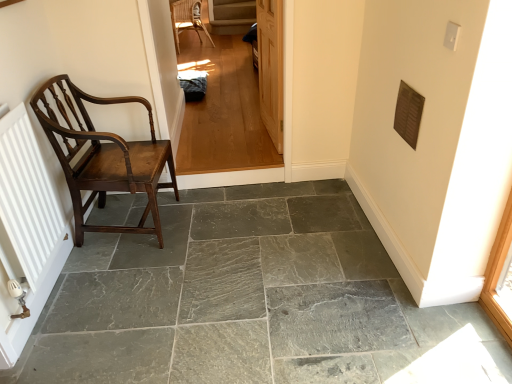
Question: From a real-world perspective, is polished wood chair at left, marked as the second chair in a top-to-bottom arrangement, under light brown wood floor at center?

Choices:
 (A) no
 (B) yes

Answer: (B)

Question: Is polished wood chair at left, the first chair when ordered from front to back, smaller than light brown wood floor at center?

Choices:
 (A) yes
 (B) no

Answer: (B)

Question: Is polished wood chair at left, marked as the 1th chair in a bottom-to-top arrangement, further to the viewer compared to light brown wood floor at center?

Choices:
 (A) yes
 (B) no

Answer: (B)

Question: Does polished wood chair at left, marked as the 1th chair in a bottom-to-top arrangement, have a larger size compared to light brown wood floor at center?

Choices:
 (A) no
 (B) yes

Answer: (B)

Question: Can you confirm if polished wood chair at left, marked as the second chair in a top-to-bottom arrangement, is wider than light brown wood floor at center?

Choices:
 (A) yes
 (B) no

Answer: (A)

Question: From a real-world perspective, relative to wooden door at center, is polished wood chair at left, marked as the second chair in a top-to-bottom arrangement, vertically above or below?

Choices:
 (A) below
 (B) above

Answer: (A)

Question: Considering the positions of point (77, 97) and point (274, 69), is point (77, 97) closer or farther from the camera than point (274, 69)?

Choices:
 (A) closer
 (B) farther

Answer: (A)

Question: Considering their positions, is polished wood chair at left, marked as the second chair in a top-to-bottom arrangement, located in front of or behind wooden door at center?

Choices:
 (A) front
 (B) behind

Answer: (A)

Question: Choose the correct answer: Is polished wood chair at left, acting as the 2th chair starting from the back, inside wooden door at center or outside it?

Choices:
 (A) inside
 (B) outside

Answer: (B)

Question: Considering their positions, is polished wood chair at left, marked as the second chair in a top-to-bottom arrangement, located in front of or behind light brown wood floor at center?

Choices:
 (A) front
 (B) behind

Answer: (A)

Question: In terms of width, does polished wood chair at left, the first chair when ordered from front to back, look wider or thinner when compared to light brown wood floor at center?

Choices:
 (A) wide
 (B) thin

Answer: (A)

Question: From a real-world perspective, is polished wood chair at left, the first chair when ordered from front to back, above or below light brown wood floor at center?

Choices:
 (A) below
 (B) above

Answer: (A)

Question: From the image's perspective, is polished wood chair at left, the first chair when ordered from front to back, positioned above or below light brown wood floor at center?

Choices:
 (A) above
 (B) below

Answer: (B)

Question: Would you say wooden door at center is inside or outside polished wood chair at left, marked as the second chair in a top-to-bottom arrangement?

Choices:
 (A) outside
 (B) inside

Answer: (A)

Question: In terms of size, does wooden door at center appear bigger or smaller than polished wood chair at left, the first chair when ordered from front to back?

Choices:
 (A) big
 (B) small

Answer: (B)